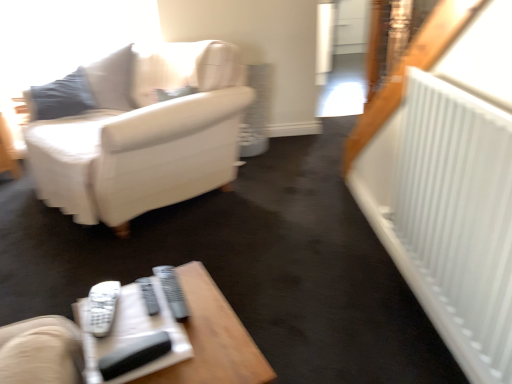
Question: Should I look upward or downward to see wooden table at lower center?

Choices:
 (A) up
 (B) down

Answer: (B)

Question: Can you confirm if white leather couch at upper left is taller than wooden table at lower center?

Choices:
 (A) no
 (B) yes

Answer: (B)

Question: Is white leather couch at upper left in contact with wooden table at lower center?

Choices:
 (A) yes
 (B) no

Answer: (B)

Question: Could you tell me if white leather couch at upper left is facing wooden table at lower center?

Choices:
 (A) no
 (B) yes

Answer: (A)

Question: Can you confirm if white leather couch at upper left is bigger than wooden table at lower center?

Choices:
 (A) yes
 (B) no

Answer: (A)

Question: From a real-world perspective, is white leather couch at upper left under wooden table at lower center?

Choices:
 (A) no
 (B) yes

Answer: (A)

Question: Can you confirm if white leather couch at upper left is positioned to the right of wooden table at lower center?

Choices:
 (A) no
 (B) yes

Answer: (A)

Question: Does white plastic remote at lower center, which is counted as the 2th remote, starting from the right, appear on the left side of gray plastic remote at center, which is the second remote in left-to-right order?

Choices:
 (A) yes
 (B) no

Answer: (A)

Question: Is white plastic remote at lower center, which is counted as the 2th remote, starting from the right, closer to camera compared to gray plastic remote at center, which is the second remote in left-to-right order?

Choices:
 (A) no
 (B) yes

Answer: (B)

Question: Is there a large distance between white plastic remote at lower center, the first remote from the left, and gray plastic remote at center, which appears as the first remote when viewed from the right?

Choices:
 (A) no
 (B) yes

Answer: (A)

Question: Is white plastic remote at lower center, the first remote from the left, bigger than gray plastic remote at center, which appears as the first remote when viewed from the right?

Choices:
 (A) yes
 (B) no

Answer: (A)

Question: From the image's perspective, is white plastic remote at lower center, which is counted as the 2th remote, starting from the right, on gray plastic remote at center, which appears as the first remote when viewed from the right?

Choices:
 (A) yes
 (B) no

Answer: (B)

Question: Is white plastic remote at lower center, the first remote from the left, further to the viewer compared to gray plastic remote at center, which appears as the first remote when viewed from the right?

Choices:
 (A) yes
 (B) no

Answer: (B)

Question: Are gray plastic remote at center, which is the second remote in left-to-right order, and white leather couch at upper left far apart?

Choices:
 (A) no
 (B) yes

Answer: (B)